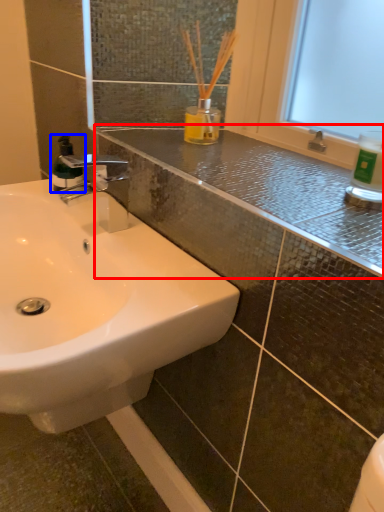
Question: Which object is further to the camera taking this photo, counter top (highlighted by a red box) or mouthwash (highlighted by a blue box)?

Choices:
 (A) counter top
 (B) mouthwash

Answer: (B)